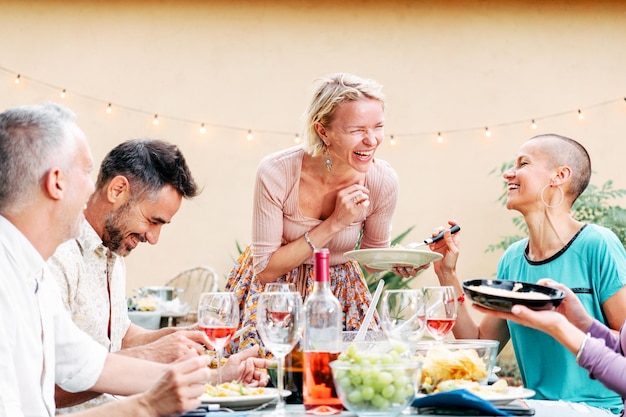
At what (x,y) coordinates should I click in order to perform the action: click on wine glass. Please return your answer as a coordinate pair (x, y). Image resolution: width=626 pixels, height=417 pixels. Looking at the image, I should click on (274, 314), (207, 314), (269, 287), (396, 322), (443, 312).